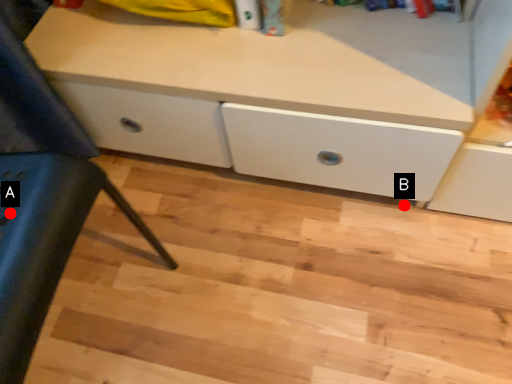
Question: Two points are circled on the image, labeled by A and B beside each circle. Which point is closer to the camera?

Choices:
 (A) A is closer
 (B) B is closer

Answer: (A)